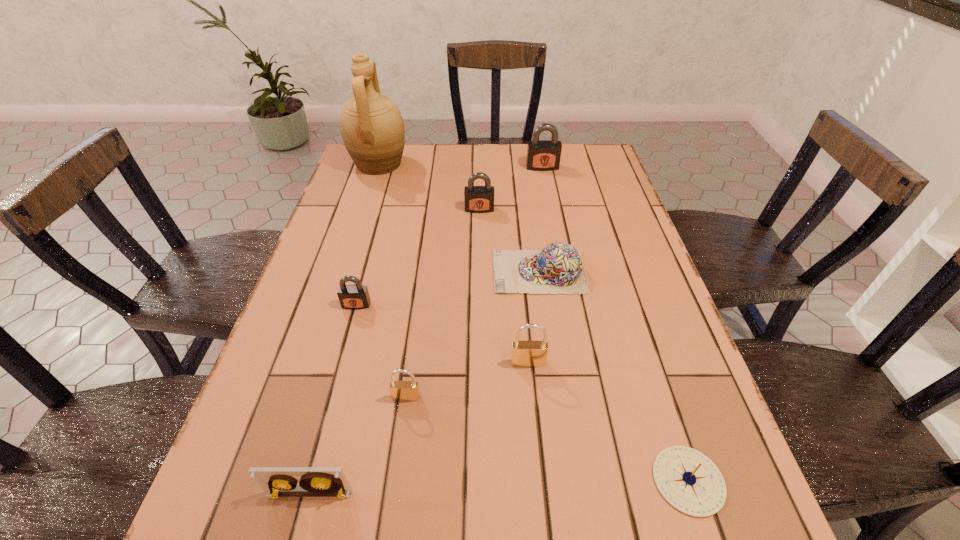
Where is `unoccupied area between the fourth padlock from left to right and the rightmost object`? unoccupied area between the fourth padlock from left to right and the rightmost object is located at coordinates (609, 422).

The width and height of the screenshot is (960, 540). In order to click on unoccupied area between the second nearest gray padlock and the fourth object from left to right in this screenshot , I will do `click(443, 303)`.

Locate an element on the screen. The width and height of the screenshot is (960, 540). free space between the fourth farthest object and the blue compass is located at coordinates (613, 376).

The image size is (960, 540). In order to click on vacant area that lies between the compass and the pitcher in this screenshot , I will do `click(534, 322)`.

This screenshot has height=540, width=960. In order to click on free area in between the shortest object and the smaller brass padlock in this screenshot , I will do `click(547, 439)`.

Find the location of a particular element. The image size is (960, 540). unoccupied area between the second gray padlock from left to right and the left brass padlock is located at coordinates (443, 303).

Where is `object that is the third nearest to the seventh farthest object`? object that is the third nearest to the seventh farthest object is located at coordinates (354, 297).

I want to click on object that is the third nearest to the fourth farthest object, so click(354, 297).

Identify which padlock is the third nearest to the leftmost gray padlock. Please provide its 2D coordinates. Your answer should be formatted as a tuple, i.e. [(x, y)], where the tuple contains the x and y coordinates of a point satisfying the conditions above.

[(478, 199)]

I want to click on padlock that is the third closest to the sixth farthest object, so click(478, 199).